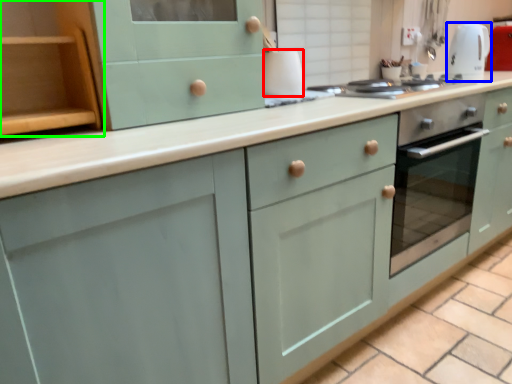
Question: Which object is the farthest from appliance (highlighted by a red box)? Choose among these: kitchen appliance (highlighted by a blue box) or cabinetry (highlighted by a green box).

Choices:
 (A) kitchen appliance
 (B) cabinetry

Answer: (A)